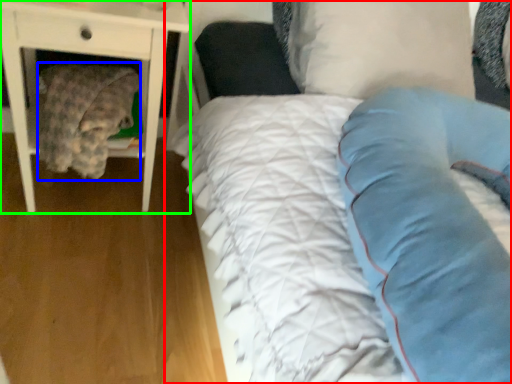
Question: Which object is positioned closest to bed (highlighted by a red box)? Select from material (highlighted by a blue box) and nightstand (highlighted by a green box).

Choices:
 (A) material
 (B) nightstand

Answer: (B)